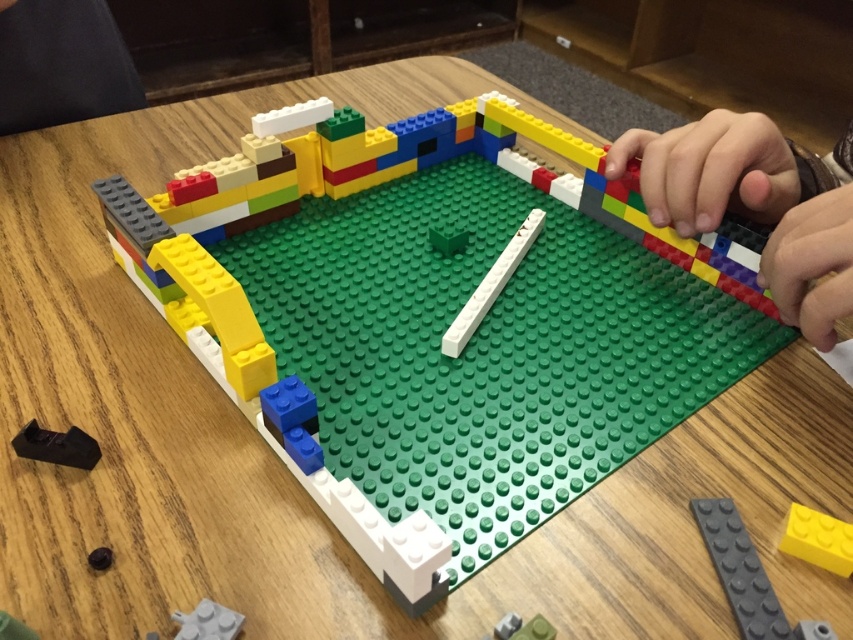
Question: Does smooth plastic hand at upper right appear on the left side of matte black lego piece at lower left?

Choices:
 (A) no
 (B) yes

Answer: (A)

Question: Is yellow matte brick at center to the left of black plastic piece at lower left from the viewer's perspective?

Choices:
 (A) no
 (B) yes

Answer: (A)

Question: Estimate the real-world distances between objects in this image. Which object is closer to the gray matte brick at bottom right?

Choices:
 (A) smooth plastic hand at upper right
 (B) black plastic piece at lower left
 (C) yellow matte brick at center
 (D) matte black lego piece at lower left

Answer: (C)

Question: Which object is positioned closest to the matte black lego piece at lower left?

Choices:
 (A) yellow matte brick at center
 (B) gray matte brick at bottom right
 (C) black plastic piece at lower left
 (D) smooth plastic hand at upper right

Answer: (C)

Question: Which of the following is the farthest from the observer?

Choices:
 (A) (734, 588)
 (B) (790, 531)
 (C) (804, 273)

Answer: (C)

Question: Can you confirm if smooth plastic hand at upper right is positioned to the left of yellow matte brick at center?

Choices:
 (A) yes
 (B) no

Answer: (B)